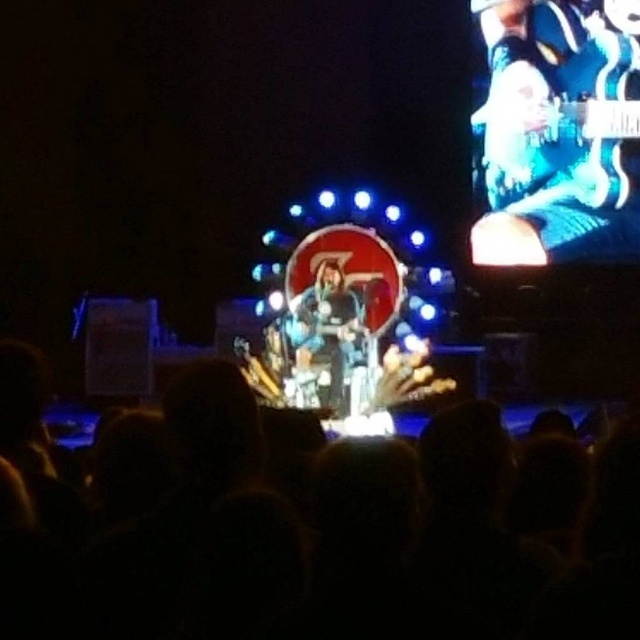
You are a photographer at the concert and want to capture a clear shot of the silhouette hair at center and the shiny black guitar at center. Which object is closer to the camera lens?

The silhouette hair at center is positioned under the shiny black guitar at center, so the shiny black guitar at center is closer to the camera lens.

You are a photographer at the concert and want to capture a photo of the silhouette hair at center and the blue metallic guitar at upper right. Which object is located to the left of the other?

The silhouette hair at center is positioned on the left side of blue metallic guitar at upper right.